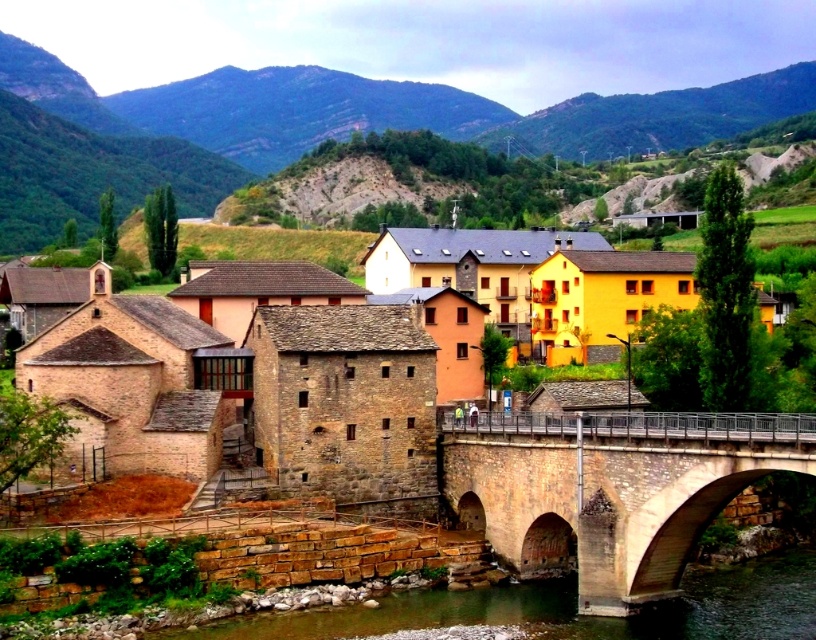
Question: Which object is the farthest from the stone bridge at center?

Choices:
 (A) brown stone village at center
 (B) green grassy hillside at upper center

Answer: (B)

Question: Is green grassy hillside at upper center closer to camera compared to stone bridge at center?

Choices:
 (A) no
 (B) yes

Answer: (A)

Question: Among these points, which one is farthest from the camera?

Choices:
 (A) (714, 608)
 (B) (479, 444)

Answer: (B)

Question: Can you confirm if brown stone village at center is bigger than green grassy hillside at upper center?

Choices:
 (A) no
 (B) yes

Answer: (A)

Question: Can you confirm if stone bridge at center is smaller than brown stone river at lower center?

Choices:
 (A) yes
 (B) no

Answer: (B)

Question: Which object is positioned closest to the stone bridge at center?

Choices:
 (A) green grassy hillside at upper center
 (B) brown stone river at lower center

Answer: (B)